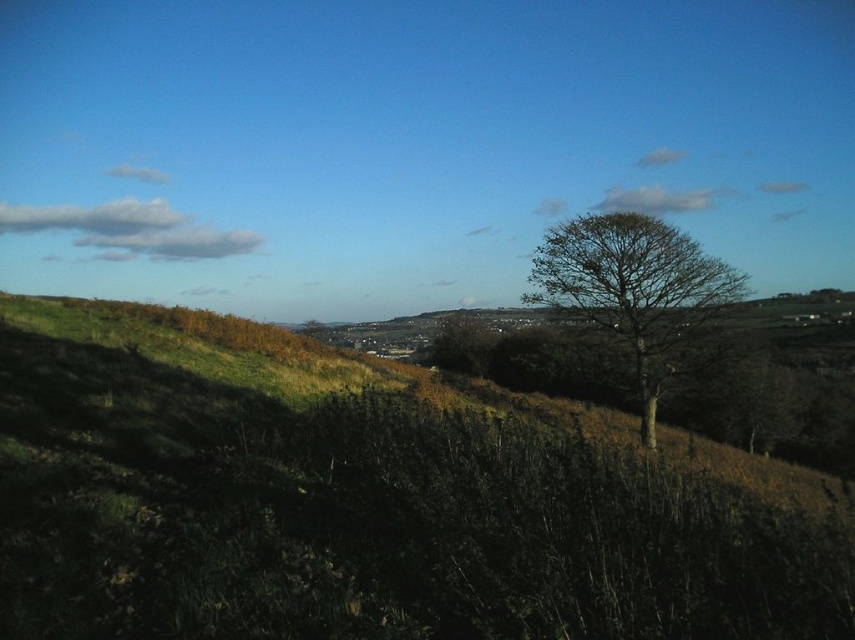
You are standing at the center of the image and want to walk to the green grassy hillside at center. In which direction should you go?

The green grassy hillside at center is located at point coordinates of (x=372, y=500), so you should move towards the right direction to reach it.